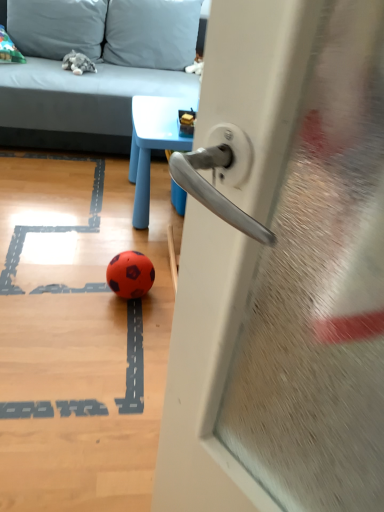
Locate an element on the screen. The width and height of the screenshot is (384, 512). free spot to the left of blue plastic table at upper center is located at coordinates (69, 203).